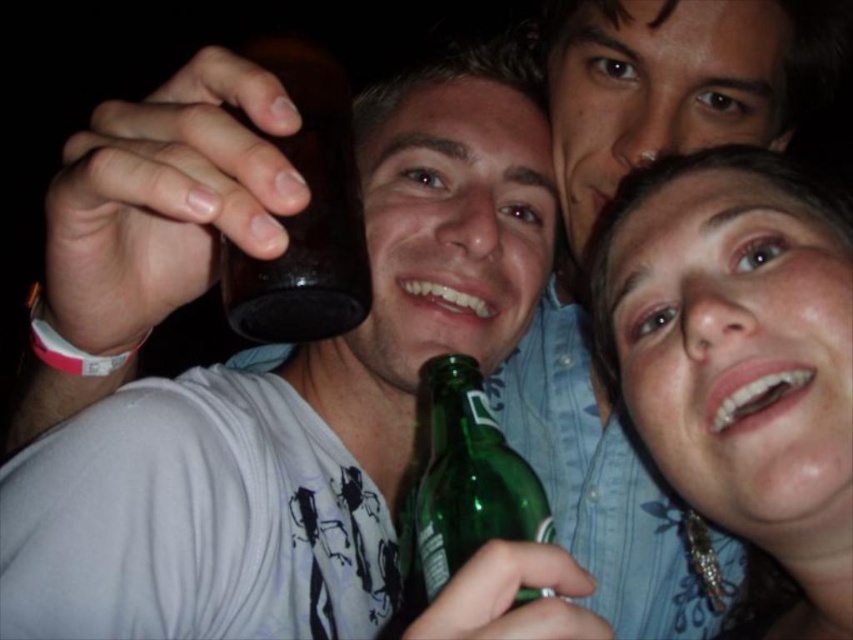
Question: Does matte green bottle at lower right appear over brown glass bottle at upper left?

Choices:
 (A) no
 (B) yes

Answer: (A)

Question: Is matte green bottle at lower right closer to the viewer compared to brown glass bottle at upper left?

Choices:
 (A) yes
 (B) no

Answer: (B)

Question: Which of the following is the closest to the observer?

Choices:
 (A) (256, 317)
 (B) (491, 508)

Answer: (A)

Question: Can you confirm if matte green bottle at lower right is positioned to the right of green glass bottle at lower center?

Choices:
 (A) yes
 (B) no

Answer: (A)

Question: Which point is closer to the camera?

Choices:
 (A) matte green bottle at lower right
 (B) brown glass bottle at upper left

Answer: (B)

Question: Which point is closer to the camera?

Choices:
 (A) (541, 540)
 (B) (809, 349)

Answer: (A)